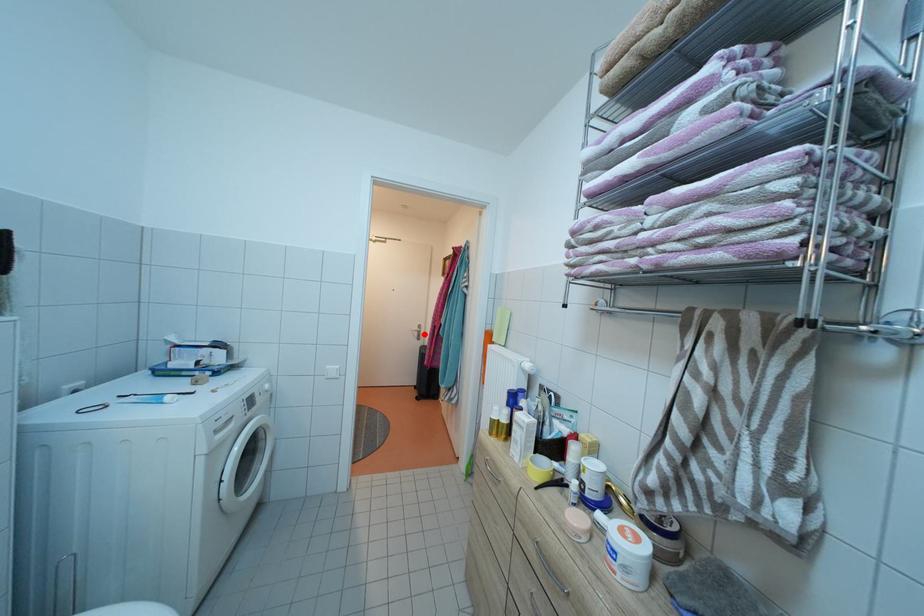
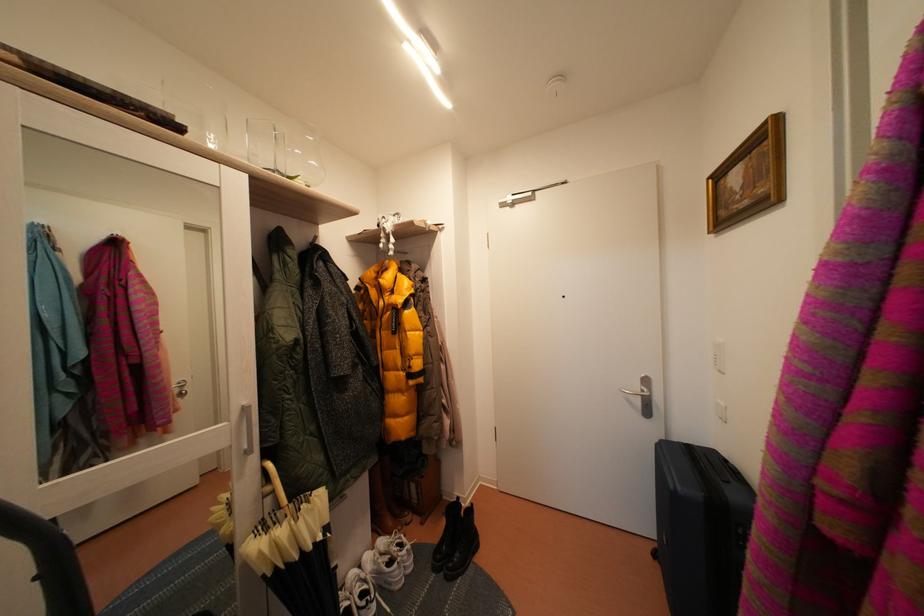
The point at the highlighted location is marked in the first image. Where is the corresponding point in the second image?

(645, 392)